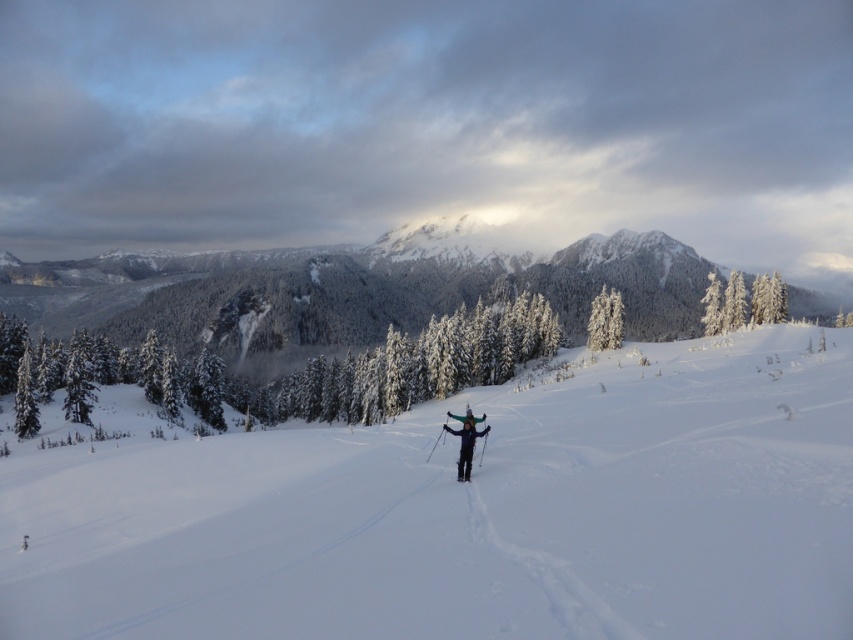
You are standing at the point labeled point [358,461] and want to walk to the point labeled point [596,314]. Given that you can only move along the ski tracks visible in the snow, will you be moving towards the camera or away from it as you walk?

Since point [358,461] is closer to the camera than point [596,314], moving from point [358,461] to point [596,314] means you are moving away from the camera along the ski tracks.

You are planning to take a photo of the two white frosty trees in the winter landscape. Which tree would you zoom in on if you want to capture a wider view of the tree without moving the camera? Please choose between the white frosty tree at upper right and the white frosty tree at upper center based on their sizes.

The white frosty tree at upper right is wider than the white frosty tree at upper center, so you should zoom in on the white frosty tree at upper right to capture a wider view without moving the camera.